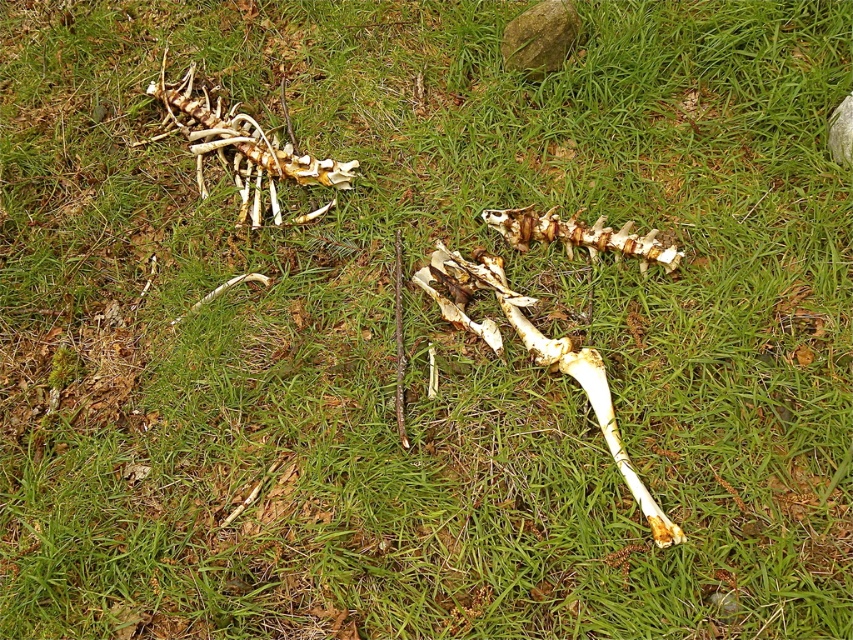
Between white bone at upper left and yellowish bone at center, which one is positioned higher?

white bone at upper left is higher up.

Does white bone at upper left appear on the right side of yellowish bone at center?

Incorrect, white bone at upper left is not on the right side of yellowish bone at center.

This screenshot has width=853, height=640. Describe the element at coordinates (241, 148) in the screenshot. I see `white bone at upper left` at that location.

Identify the location of white bone at upper left. The image size is (853, 640). (241, 148).

The image size is (853, 640). What do you see at coordinates (241, 148) in the screenshot?
I see `white bone at upper left` at bounding box center [241, 148].

Which is above, white bone at upper left or white bone at center?

Positioned higher is white bone at upper left.

Does point (253, 154) come closer to viewer compared to point (492, 227)?

No, it is behind (492, 227).

Image resolution: width=853 pixels, height=640 pixels. Find the location of `white bone at upper left`. white bone at upper left is located at coordinates (241, 148).

Between point (500, 305) and point (520, 225), which one is positioned in front?

Point (500, 305) is in front.

Who is lower down, yellowish bone at center or white bone at center?

yellowish bone at center is below.

Is point (607, 444) positioned after point (554, 232)?

No, it is in front of (554, 232).

At what (x,y) coordinates should I click in order to perform the action: click on yellowish bone at center. Please return your answer as a coordinate pair (x, y). The image size is (853, 640). Looking at the image, I should click on (537, 355).